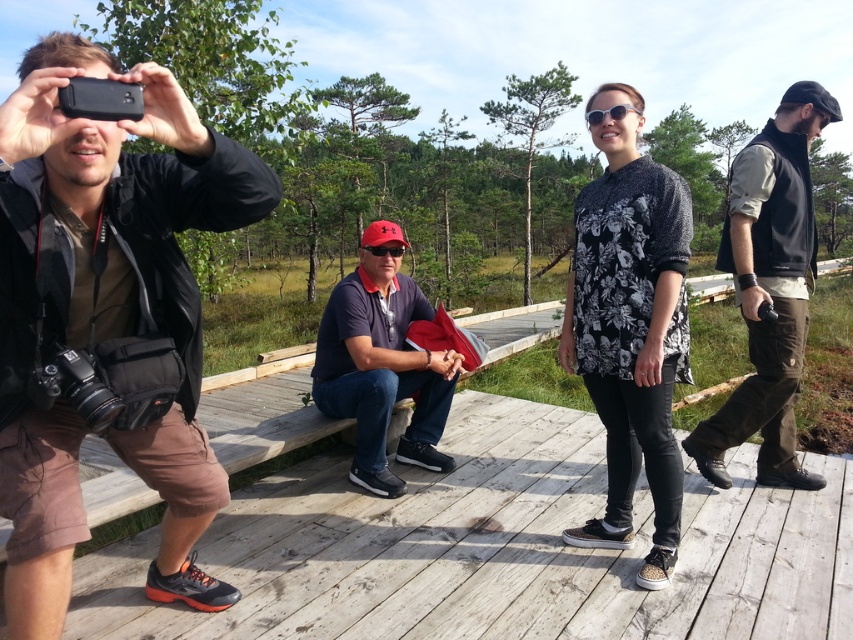
This screenshot has height=640, width=853. Describe the element at coordinates (496, 548) in the screenshot. I see `wooden at center` at that location.

Between point (733, 561) and point (791, 278), which one is positioned behind?

The point (791, 278) is behind.

Where is `wooden at center`? The height and width of the screenshot is (640, 853). wooden at center is located at coordinates (496, 548).

Locate an element on the screen. The image size is (853, 640). wooden at center is located at coordinates (496, 548).

Who is positioned more to the left, black floral shirt at center or white plastic goggles at center?

white plastic goggles at center is more to the left.

Can you confirm if black floral shirt at center is taller than white plastic goggles at center?

Yes.

Does point (680, 342) lie behind point (601, 116)?

No.

You are a GUI agent. You are given a task and a screenshot of the screen. Output one action in this format:
    pyautogui.click(x=<x>, y=<y>)
    Task: Click on the black floral shirt at center
    Image resolution: width=853 pixels, height=640 pixels.
    Given the screenshot: What is the action you would take?
    pyautogui.click(x=630, y=333)

Who is lower down, matte black camera at left or black fleece vest at center?

matte black camera at left

Which is behind, point (154, 113) or point (721, 476)?

Positioned behind is point (721, 476).

Where is `matte black camera at left`? This screenshot has height=640, width=853. matte black camera at left is located at coordinates (107, 312).